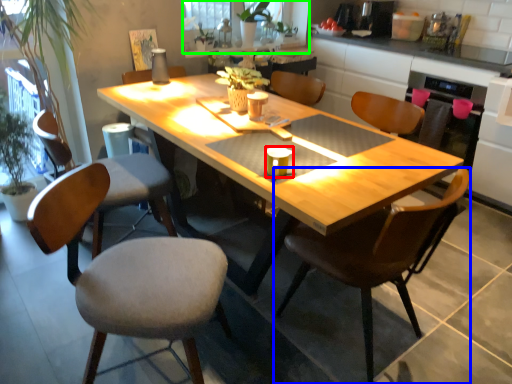
Question: Which object is the closest to the coffee cup (highlighted by a red box)? Choose among these: chair (highlighted by a blue box) or window screen (highlighted by a green box).

Choices:
 (A) chair
 (B) window screen

Answer: (A)